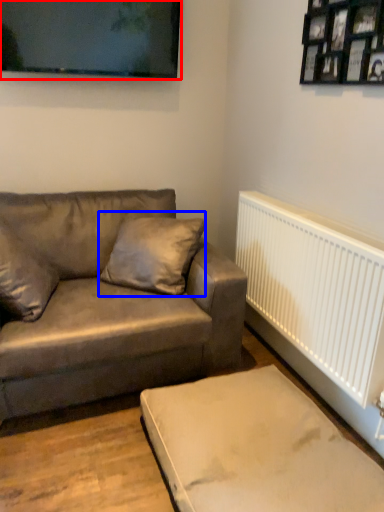
Question: Which point is further to the camera, picture frame (highlighted by a red box) or pillow (highlighted by a blue box)?

Choices:
 (A) picture frame
 (B) pillow

Answer: (A)